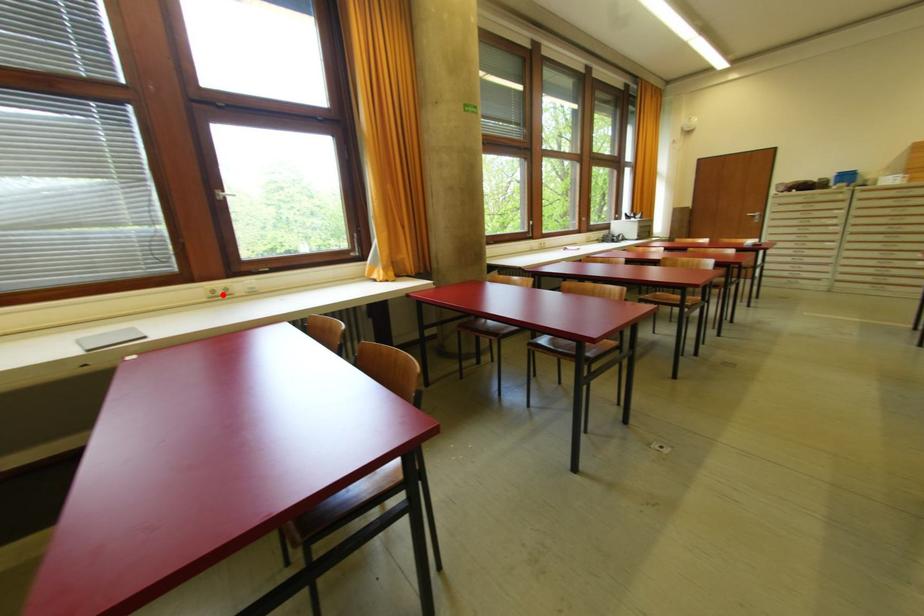
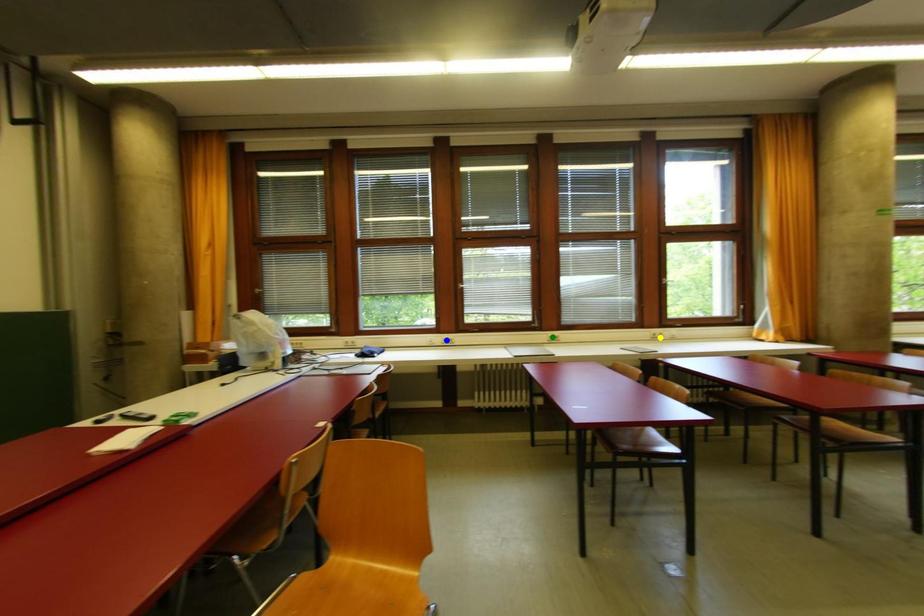
Question: I am providing you with two images of the same scene from different viewpoints. A red point is marked on the first image. You are given multiple points on the second image. Can you choose the point in image 2 that corresponds to the point in image 1?

Choices:
 (A) blue point
 (B) green point
 (C) yellow point

Answer: (C)